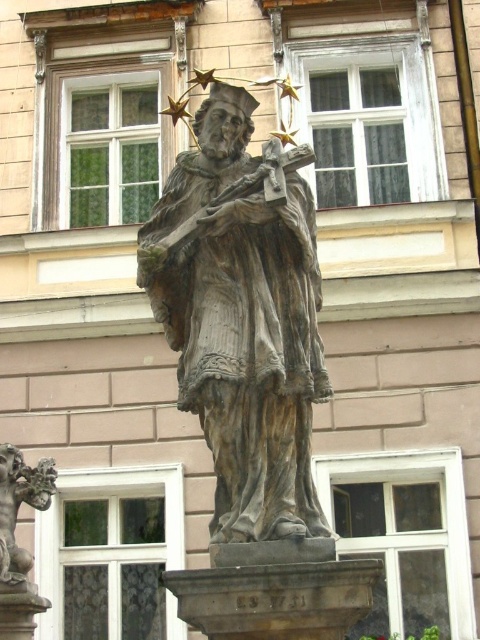
Question: Which of the following is the closest to the observer?

Choices:
 (A) (11, 452)
 (B) (280, 262)

Answer: (B)

Question: Is wooden statue at center below bronze statue at lower left?

Choices:
 (A) no
 (B) yes

Answer: (A)

Question: From the image, what is the correct spatial relationship of wooden statue at center in relation to bronze statue at lower left?

Choices:
 (A) right
 (B) left

Answer: (A)

Question: Which point appears closest to the camera in this image?

Choices:
 (A) (222, 246)
 (B) (47, 496)

Answer: (A)

Question: Can you confirm if wooden statue at center is positioned below bronze statue at lower left?

Choices:
 (A) yes
 (B) no

Answer: (B)